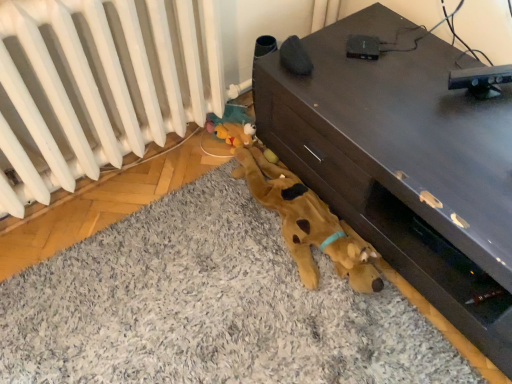
Question: Considering the relative sizes of soft gray carpet at lower center and white matte radiator at lower left in the image provided, is soft gray carpet at lower center taller than white matte radiator at lower left?

Choices:
 (A) yes
 (B) no

Answer: (B)

Question: Considering the relative sizes of soft gray carpet at lower center and white matte radiator at lower left in the image provided, is soft gray carpet at lower center bigger than white matte radiator at lower left?

Choices:
 (A) no
 (B) yes

Answer: (A)

Question: Is soft gray carpet at lower center oriented towards white matte radiator at lower left?

Choices:
 (A) yes
 (B) no

Answer: (B)

Question: Can you confirm if soft gray carpet at lower center is positioned to the right of white matte radiator at lower left?

Choices:
 (A) yes
 (B) no

Answer: (A)

Question: From a real-world perspective, is soft gray carpet at lower center beneath white matte radiator at lower left?

Choices:
 (A) no
 (B) yes

Answer: (B)

Question: Is soft gray carpet at lower center not within white matte radiator at lower left?

Choices:
 (A) no
 (B) yes

Answer: (B)

Question: Is soft gray carpet at lower center bigger than brown matte tv stand at lower right?

Choices:
 (A) no
 (B) yes

Answer: (A)

Question: From a real-world perspective, does soft gray carpet at lower center stand above brown matte tv stand at lower right?

Choices:
 (A) yes
 (B) no

Answer: (B)

Question: Is brown matte tv stand at lower right surrounded by soft gray carpet at lower center?

Choices:
 (A) no
 (B) yes

Answer: (A)

Question: Does soft gray carpet at lower center have a greater height compared to brown matte tv stand at lower right?

Choices:
 (A) yes
 (B) no

Answer: (B)

Question: Is soft gray carpet at lower center further to camera compared to brown matte tv stand at lower right?

Choices:
 (A) yes
 (B) no

Answer: (B)

Question: Is soft gray carpet at lower center wider than brown matte tv stand at lower right?

Choices:
 (A) yes
 (B) no

Answer: (A)

Question: From a real-world perspective, is brown matte tv stand at lower right under white matte radiator at lower left?

Choices:
 (A) yes
 (B) no

Answer: (A)